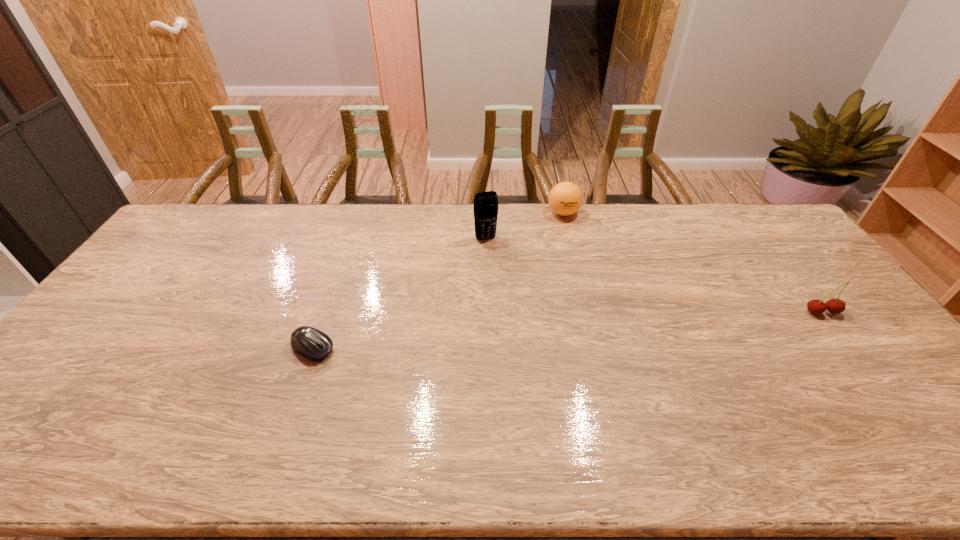
In the image, there is a desktop. Where is `vacant area at the near edge`? The height and width of the screenshot is (540, 960). vacant area at the near edge is located at coordinates (502, 411).

Locate an element on the screen. The image size is (960, 540). free space at the left edge of the desktop is located at coordinates (200, 245).

The width and height of the screenshot is (960, 540). I want to click on free spot at the right edge of the desktop, so click(x=805, y=314).

Find the location of `vacant space at the far right corner of the desktop`. vacant space at the far right corner of the desktop is located at coordinates (741, 225).

At what (x,y) coordinates should I click in order to perform the action: click on free space between the third farthest object and the shortest object. Please return your answer as a coordinate pair (x, y). Image resolution: width=960 pixels, height=540 pixels. Looking at the image, I should click on (567, 330).

This screenshot has height=540, width=960. Identify the location of vacant region between the second object from left to right and the nearest object. (399, 293).

Identify the location of empty space that is in between the third farthest object and the third nearest object. (654, 275).

Find the location of a particular element. free space that is in between the nearest object and the second object from right to left is located at coordinates click(x=438, y=280).

I want to click on free space between the rightmost object and the leftmost object, so click(x=567, y=330).

Where is `unoccupied position between the cherry and the shortest object`? The image size is (960, 540). unoccupied position between the cherry and the shortest object is located at coordinates (567, 330).